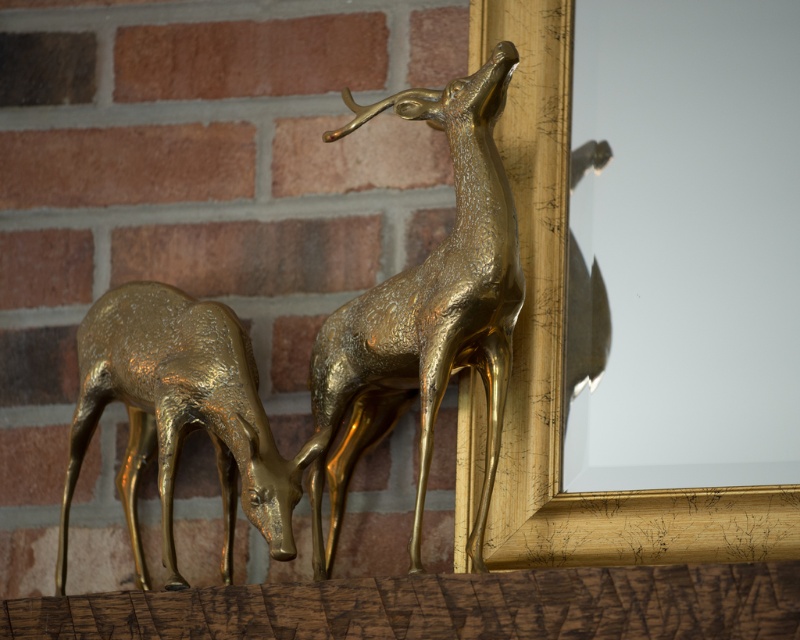
Question: Where is shiny gold deer at upper center located in relation to shiny gold deer at left in the image?

Choices:
 (A) left
 (B) right

Answer: (B)

Question: Considering the relative positions of shiny gold deer at upper center and shiny gold deer at left in the image provided, where is shiny gold deer at upper center located with respect to shiny gold deer at left?

Choices:
 (A) above
 (B) below

Answer: (A)

Question: Can you confirm if shiny gold deer at upper center is wider than shiny gold deer at left?

Choices:
 (A) yes
 (B) no

Answer: (B)